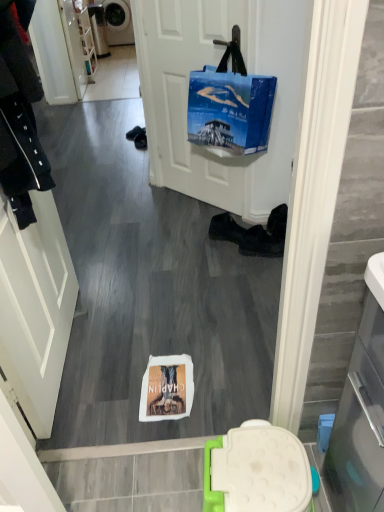
Find the location of a particular element. The height and width of the screenshot is (512, 384). vacant area that lies between white glossy door at left and white paper bag at center is located at coordinates (99, 355).